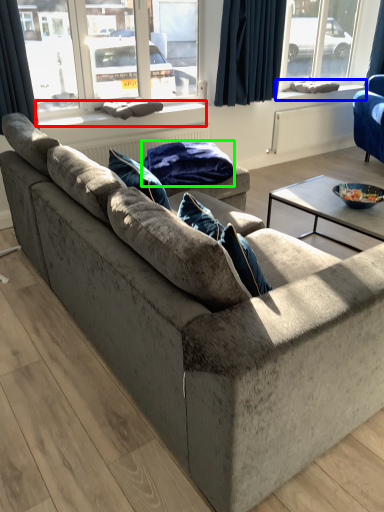
Question: Considering the real-world distances, which object is farthest from window sill (highlighted by a red box)? window sill (highlighted by a blue box) or material (highlighted by a green box)?

Choices:
 (A) window sill
 (B) material

Answer: (A)